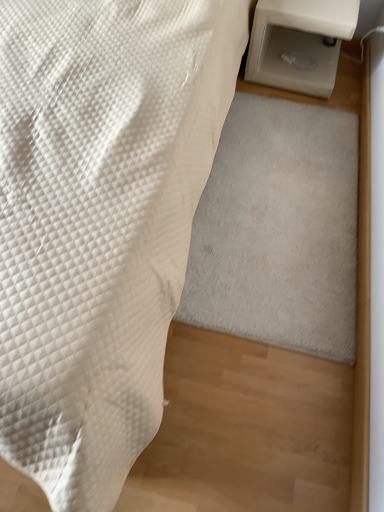
This screenshot has width=384, height=512. What do you see at coordinates (278, 229) in the screenshot?
I see `white soft rug at lower right` at bounding box center [278, 229].

Measure the distance between white quilted fabric at lower left and camera.

white quilted fabric at lower left and camera are 29.66 inches apart.

Find the location of a particular element. white soft rug at lower right is located at coordinates (278, 229).

Which of these two, white quilted fabric at lower left or white soft rug at lower right, is thinner?

white soft rug at lower right.

In terms of height, does white quilted fabric at lower left look taller or shorter compared to white soft rug at lower right?

white quilted fabric at lower left is taller than white soft rug at lower right.

From the image's perspective, is white quilted fabric at lower left on white soft rug at lower right?

Indeed, from the image's perspective, white quilted fabric at lower left is shown above white soft rug at lower right.

In the scene shown: Does white quilted fabric at lower left appear on the right side of white soft rug at lower right?

In fact, white quilted fabric at lower left is to the left of white soft rug at lower right.

Which is correct: white plastic table at right is inside white quilted fabric at lower left, or outside of it?

The correct answer is: outside.

What's the angular difference between white plastic table at right and white quilted fabric at lower left's facing directions?

5.48 degrees.

From the image's perspective, which object appears higher, white plastic table at right or white quilted fabric at lower left?

white plastic table at right appears higher in the image.

Which of these two, white plastic table at right or white quilted fabric at lower left, stands taller?

Standing taller between the two is white quilted fabric at lower left.

Between white plastic table at right and white soft rug at lower right, which one has larger width?

With larger width is white soft rug at lower right.

Is white plastic table at right oriented away from white soft rug at lower right?

No.

Who is more distant, white plastic table at right or white soft rug at lower right?

Positioned behind is white plastic table at right.

From the image's perspective, is white plastic table at right located beneath white soft rug at lower right?

Incorrect, from the image's perspective, white plastic table at right is higher than white soft rug at lower right.

Considering the sizes of white soft rug at lower right and white plastic table at right in the image, is white soft rug at lower right taller or shorter than white plastic table at right?

Clearly, white soft rug at lower right is shorter compared to white plastic table at right.

Locate an element on the screen. The image size is (384, 512). mat located below the white plastic table at right (from the image's perspective) is located at coordinates (278, 229).

From a real-world perspective, relative to white plastic table at right, is white soft rug at lower right vertically above or below?

white soft rug at lower right is situated lower than white plastic table at right in the real world.

Does white soft rug at lower right have a greater width compared to white quilted fabric at lower left?

Incorrect, the width of white soft rug at lower right does not surpass that of white quilted fabric at lower left.

Locate an element on the screen. mat below the white quilted fabric at lower left (from the image's perspective) is located at coordinates (278, 229).

Could you tell me if white soft rug at lower right is turned towards white quilted fabric at lower left?

No.

Which of these two, white quilted fabric at lower left or white plastic table at right, is smaller?

With smaller size is white plastic table at right.

How many degrees apart are the facing directions of white quilted fabric at lower left and white plastic table at right?

5.48 degrees.

Where is `table above the white quilted fabric at lower left (from the image's perspective)`? table above the white quilted fabric at lower left (from the image's perspective) is located at coordinates (299, 42).

Which object is closer to the camera taking this photo, white quilted fabric at lower left or white plastic table at right?

white quilted fabric at lower left is more forward.

Locate an element on the screen. The image size is (384, 512). furniture positioned vertically above the white soft rug at lower right (from a real-world perspective) is located at coordinates (100, 221).

You are a GUI agent. You are given a task and a screenshot of the screen. Output one action in this format:
    pyautogui.click(x=<x>, y=<y>)
    Task: Click on the furniture in front of the white plastic table at right
    The height and width of the screenshot is (512, 384).
    Given the screenshot: What is the action you would take?
    pyautogui.click(x=100, y=221)

Looking at the image, which one is located further to white plastic table at right, white soft rug at lower right or white quilted fabric at lower left?

The object further to white plastic table at right is white quilted fabric at lower left.

Considering their positions, is white quilted fabric at lower left positioned further to white plastic table at right than white soft rug at lower right?

The object further to white plastic table at right is white quilted fabric at lower left.

From the image, which object appears to be farther from white quilted fabric at lower left, white plastic table at right or white soft rug at lower right?

white plastic table at right lies further to white quilted fabric at lower left than the other object.

Considering their positions, is white soft rug at lower right positioned closer to white quilted fabric at lower left than white plastic table at right?

white soft rug at lower right is closer to white quilted fabric at lower left.

Based on their spatial positions, is white quilted fabric at lower left or white plastic table at right closer to white soft rug at lower right?

The object closer to white soft rug at lower right is white quilted fabric at lower left.

Based on their spatial positions, is white plastic table at right or white quilted fabric at lower left further from white soft rug at lower right?

white plastic table at right is further to white soft rug at lower right.

Where is `mat positioned between white quilted fabric at lower left and white plastic table at right from near to far`? This screenshot has height=512, width=384. mat positioned between white quilted fabric at lower left and white plastic table at right from near to far is located at coordinates (278, 229).